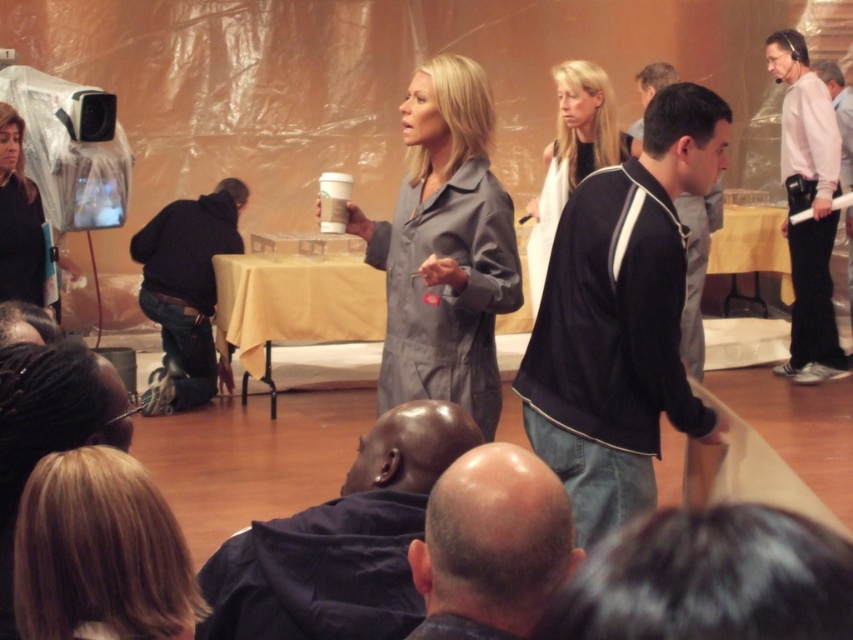
What do you see at coordinates (494, 540) in the screenshot? Image resolution: width=853 pixels, height=640 pixels. I see `bald head at center` at bounding box center [494, 540].

Can you confirm if bald head at center is bigger than matte black jacket at left?

Incorrect, bald head at center is not larger than matte black jacket at left.

The image size is (853, 640). What are the coordinates of `bald head at center` in the screenshot? It's located at (494, 540).

This screenshot has width=853, height=640. I want to click on bald head at center, so click(494, 540).

Is white fabric jacket at center above black jersey at center?

Yes.

Does white fabric jacket at center have a larger size compared to black jersey at center?

Indeed, white fabric jacket at center has a larger size compared to black jersey at center.

The image size is (853, 640). I want to click on white fabric jacket at center, so click(573, 154).

Is gray fabric jumpsuit at center taller than white cotton shirt at right?

No.

Which of these two, gray fabric jumpsuit at center or white cotton shirt at right, stands shorter?

gray fabric jumpsuit at center

Image resolution: width=853 pixels, height=640 pixels. Find the location of `gray fabric jumpsuit at center`. gray fabric jumpsuit at center is located at coordinates (445, 248).